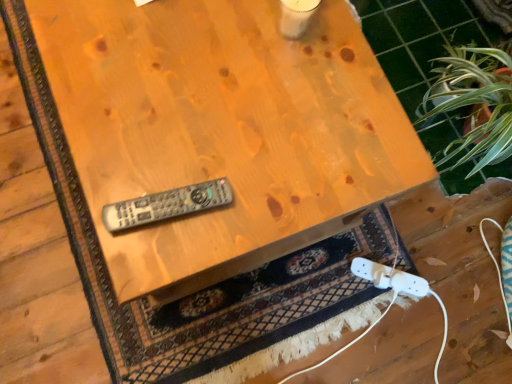
What are the coordinates of `vacant space situated on the left part of white plastic game controller at lower right` in the screenshot? It's located at (330, 271).